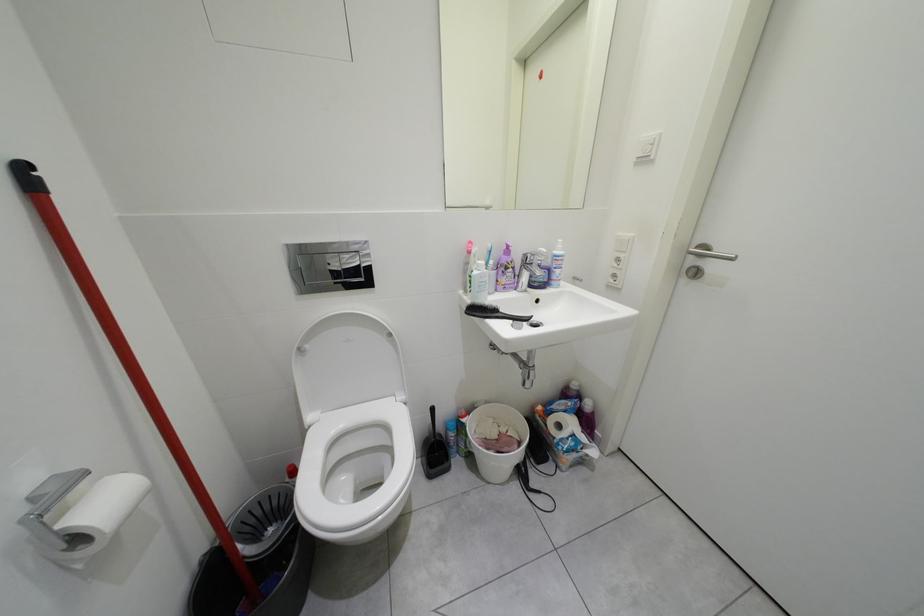
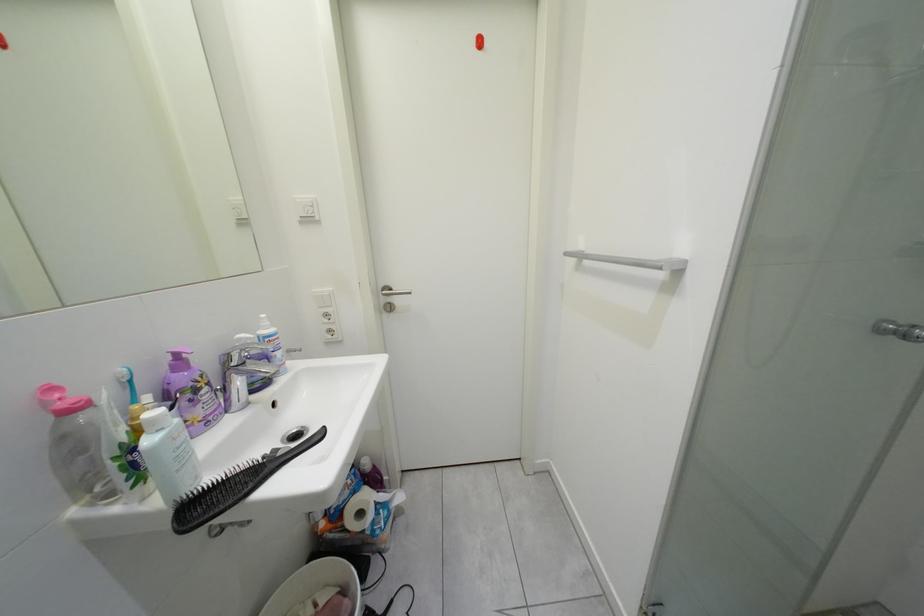
Question: The first image is from the beginning of the video and the second image is from the end. How did the camera likely rotate when shooting the video?

Choices:
 (A) Left
 (B) Right
 (C) Up
 (D) Down

Answer: (B)